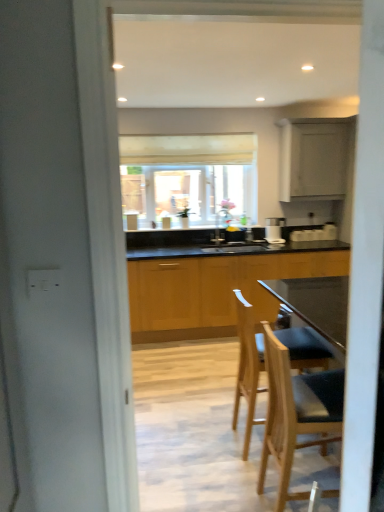
Question: Is matte white window at center turned away from wooden cabinets at center, which is the 2th cabinetry in top-to-bottom order?

Choices:
 (A) yes
 (B) no

Answer: (B)

Question: Is matte white window at center to the right of wooden cabinets at center, which is the 2th cabinetry in top-to-bottom order, from the viewer's perspective?

Choices:
 (A) no
 (B) yes

Answer: (A)

Question: From the image's perspective, is matte white window at center beneath wooden cabinets at center, which is the 2th cabinetry in top-to-bottom order?

Choices:
 (A) yes
 (B) no

Answer: (B)

Question: From a real-world perspective, is matte white window at center under wooden cabinets at center, which is the 2th cabinetry in top-to-bottom order?

Choices:
 (A) yes
 (B) no

Answer: (B)

Question: Is matte white window at center further to camera compared to wooden cabinets at center, which is the 2th cabinetry in top-to-bottom order?

Choices:
 (A) yes
 (B) no

Answer: (A)

Question: Is matte white window at center in front of wooden cabinets at center, arranged as the first cabinetry when ordered from the bottom?

Choices:
 (A) yes
 (B) no

Answer: (B)

Question: Are satin silver coffee machine at center and light wood bar stool at center, which is counted as the second chair, starting from the front, far apart?

Choices:
 (A) no
 (B) yes

Answer: (B)

Question: Is satin silver coffee machine at center oriented towards light wood bar stool at center, which is the first chair in back-to-front order?

Choices:
 (A) no
 (B) yes

Answer: (B)

Question: Does satin silver coffee machine at center have a lesser height compared to light wood bar stool at center, which is the first chair in back-to-front order?

Choices:
 (A) no
 (B) yes

Answer: (B)

Question: From a real-world perspective, is satin silver coffee machine at center positioned under light wood bar stool at center, which is counted as the second chair, starting from the front, based on gravity?

Choices:
 (A) no
 (B) yes

Answer: (A)

Question: Can you confirm if satin silver coffee machine at center is smaller than light wood bar stool at center, which is the first chair in back-to-front order?

Choices:
 (A) no
 (B) yes

Answer: (B)

Question: Does satin silver coffee machine at center have a greater width compared to light wood bar stool at center, which is the first chair in back-to-front order?

Choices:
 (A) yes
 (B) no

Answer: (B)

Question: Is wooden cabinets at center, which is the 2th cabinetry in top-to-bottom order, bigger than wooden bar stool at center, the 1th chair in the front-to-back sequence?

Choices:
 (A) no
 (B) yes

Answer: (B)